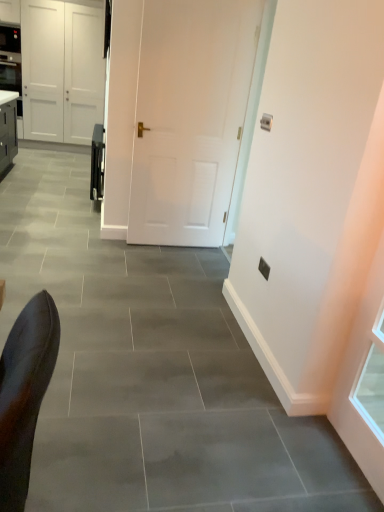
Image resolution: width=384 pixels, height=512 pixels. Identify the location of satin black oven at center. (97, 163).

The width and height of the screenshot is (384, 512). What do you see at coordinates (61, 70) in the screenshot?
I see `white matte door at center, the 2th door in the front-to-back sequence` at bounding box center [61, 70].

The width and height of the screenshot is (384, 512). I want to click on satin black oven at center, so click(97, 163).

In order to click on door behind the white matte door at center, which ranks as the 1th door in bottom-to-top order in this screenshot , I will do `click(61, 70)`.

Which is closer, (x=245, y=52) or (x=37, y=42)?

Point (x=245, y=52) appears to be closer to the viewer than point (x=37, y=42).

Who is smaller, white matte door at center, positioned as the 1th door in right-to-left order, or white matte door at center, the second door in the bottom-to-top sequence?

Smaller between the two is white matte door at center, positioned as the 1th door in right-to-left order.

Are white matte door at center, the 2th door in the front-to-back sequence, and white matte door at center, which ranks as the 1th door in bottom-to-top order, located far from each other?

white matte door at center, the 2th door in the front-to-back sequence, is far away from white matte door at center, which ranks as the 1th door in bottom-to-top order.

From a real-world perspective, who is located lower, white matte door at center, which ranks as the first door in top-to-bottom order, or white matte door at center, the second door viewed from the top?

From a 3D spatial view, white matte door at center, the second door viewed from the top, is below.

From the picture: Considering the sizes of objects white matte door at center, which ranks as the first door in top-to-bottom order, and white matte door at center, positioned as the 1th door in right-to-left order, in the image provided, who is taller, white matte door at center, which ranks as the first door in top-to-bottom order, or white matte door at center, positioned as the 1th door in right-to-left order,?

white matte door at center, which ranks as the first door in top-to-bottom order.

Find the location of a particular element. The image size is (384, 512). door lying above the white matte door at center, placed as the second door when sorted from back to front (from the image's perspective) is located at coordinates pos(61,70).

Is white matte door at center, which ranks as the first door in top-to-bottom order, inside satin black oven at center?

No, white matte door at center, which ranks as the first door in top-to-bottom order, is not inside satin black oven at center.

Considering the relative sizes of satin black oven at center and white matte door at center, the 2th door in the front-to-back sequence, in the image provided, is satin black oven at center wider than white matte door at center, the 2th door in the front-to-back sequence,?

No.

Is satin black oven at center facing towards white matte door at center, positioned as the 2th door in right-to-left order?

No, satin black oven at center is not facing towards white matte door at center, positioned as the 2th door in right-to-left order.

Between satin black oven at center and white matte door at center, the second door in the bottom-to-top sequence, which one has smaller size?

Smaller between the two is satin black oven at center.

Is white matte door at center, positioned as the 1th door in right-to-left order, directly adjacent to satin black oven at center?

No, white matte door at center, positioned as the 1th door in right-to-left order, is not beside satin black oven at center.

From the image's perspective, is white matte door at center, positioned as the 1th door in right-to-left order, beneath satin black oven at center?

Yes, from the image's perspective, white matte door at center, positioned as the 1th door in right-to-left order, is beneath satin black oven at center.

This screenshot has height=512, width=384. What are the coordinates of `door that is the 1st object above the satin black oven at center (from a real-world perspective)` in the screenshot? It's located at (189, 117).

Is point (202, 114) positioned behind point (102, 148)?

That is False.

From the image's perspective, is white matte door at center, the 1th door in the back-to-front sequence, above satin black oven at center?

Yes.

Which is farther, (71, 67) or (104, 144)?

Point (71, 67)

From a real-world perspective, is white matte door at center, which is counted as the first door, starting from the left, above or below satin black oven at center?

Clearly, from a real-world perspective, white matte door at center, which is counted as the first door, starting from the left, is above satin black oven at center.

Between white matte door at center, which ranks as the first door in top-to-bottom order, and satin black oven at center, which one is positioned behind?

Positioned behind is white matte door at center, which ranks as the first door in top-to-bottom order.

Which is behind, satin black oven at center or white matte door at center, the second door viewed from the top?

satin black oven at center is more distant.

Between satin black oven at center and white matte door at center, positioned as the 1th door in right-to-left order, which one has larger size?

satin black oven at center is bigger.

Can you confirm if satin black oven at center is positioned to the left of white matte door at center, the 1th door positioned from the front?

Yes.

Is satin black oven at center not inside white matte door at center, positioned as the 1th door in right-to-left order?

Yes, satin black oven at center is not within white matte door at center, positioned as the 1th door in right-to-left order.

Where is `door above the white matte door at center, positioned as the 1th door in right-to-left order (from a real-world perspective)`? door above the white matte door at center, positioned as the 1th door in right-to-left order (from a real-world perspective) is located at coordinates (61, 70).

Where is `door in front of the white matte door at center, which ranks as the first door in top-to-bottom order`? door in front of the white matte door at center, which ranks as the first door in top-to-bottom order is located at coordinates [x=189, y=117].

Considering their positions, is white matte door at center, placed as the second door when sorted from back to front, positioned closer to satin black oven at center than white matte door at center, which is counted as the first door, starting from the left?

The object closer to satin black oven at center is white matte door at center, placed as the second door when sorted from back to front.

When comparing their distances from white matte door at center, the 2th door in the front-to-back sequence, does satin black oven at center or white matte door at center, the second door viewed from the top, seem closer?

Among the two, satin black oven at center is located nearer to white matte door at center, the 2th door in the front-to-back sequence.

Based on their spatial positions, is satin black oven at center or white matte door at center, which ranks as the first door in top-to-bottom order, further from white matte door at center, which ranks as the 1th door in bottom-to-top order?

Based on the image, white matte door at center, which ranks as the first door in top-to-bottom order, appears to be further to white matte door at center, which ranks as the 1th door in bottom-to-top order.

When comparing their distances from satin black oven at center, does white matte door at center, which is counted as the first door, starting from the left, or white matte door at center, which ranks as the 1th door in bottom-to-top order, seem closer?

Among the two, white matte door at center, which ranks as the 1th door in bottom-to-top order, is located nearer to satin black oven at center.

Which object lies nearer to the anchor point white matte door at center, positioned as the 2th door in right-to-left order, white matte door at center, which ranks as the 1th door in bottom-to-top order, or satin black oven at center?

satin black oven at center is closer to white matte door at center, positioned as the 2th door in right-to-left order.

From the image, which object appears to be nearer to white matte door at center, the second door viewed from the top, white matte door at center, which is counted as the first door, starting from the left, or satin black oven at center?

satin black oven at center is positioned closer to the anchor white matte door at center, the second door viewed from the top.

The width and height of the screenshot is (384, 512). What are the coordinates of `appliance between white matte door at center, the 2th door in the left-to-right sequence, and white matte door at center, positioned as the 2th door in right-to-left order, along the z-axis` in the screenshot? It's located at (97, 163).